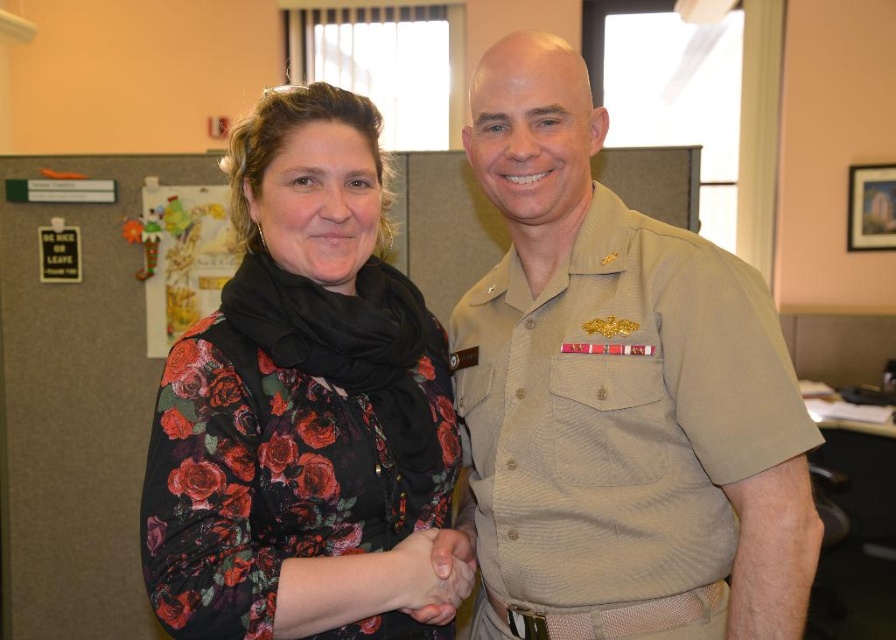
Question: Which point is farther from the camera taking this photo?

Choices:
 (A) (479, 148)
 (B) (188, 545)

Answer: (A)

Question: Among these objects, which one is farthest from the camera?

Choices:
 (A) smooth skin hand at center
 (B) floral print blouse at center

Answer: (A)

Question: Does floral print blouse at center have a greater width compared to smooth skin hand at center?

Choices:
 (A) no
 (B) yes

Answer: (B)

Question: Does floral print blouse at center appear on the right side of smooth skin hand at center?

Choices:
 (A) yes
 (B) no

Answer: (B)

Question: Does tan uniform shirt at center have a lesser width compared to floral print blouse at center?

Choices:
 (A) yes
 (B) no

Answer: (B)

Question: Which object appears farthest from the camera in this image?

Choices:
 (A) tan uniform shirt at center
 (B) floral print blouse at center
 (C) smooth skin hand at center

Answer: (C)